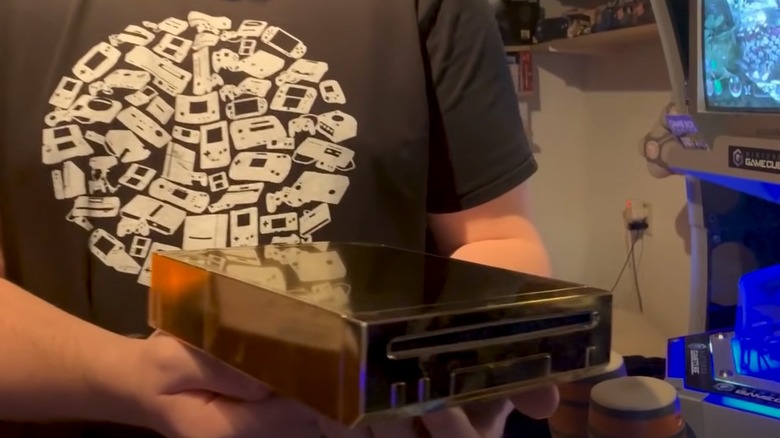
This screenshot has width=780, height=438. In order to click on dvd player in this screenshot , I will do `click(377, 288)`.